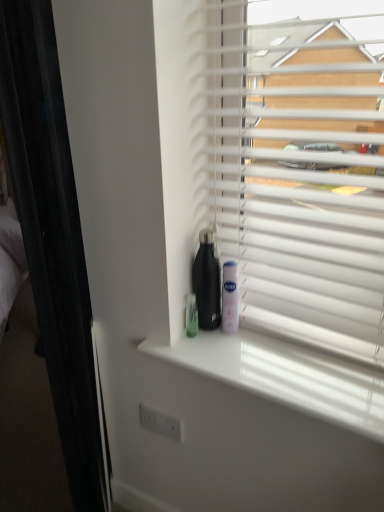
Question: From their relative heights in the image, would you say white plastic blinds at upper right is taller or shorter than white plastic mouthwash at center?

Choices:
 (A) short
 (B) tall

Answer: (B)

Question: From the image's perspective, relative to white plastic mouthwash at center, is white plastic blinds at upper right above or below?

Choices:
 (A) above
 (B) below

Answer: (A)

Question: Which object is the farthest from the white plastic blinds at upper right?

Choices:
 (A) black matte water bottle at center
 (B) white plastic mouthwash at center
 (C) white glossy window sill at center

Answer: (B)

Question: Which is farther from the white plastic blinds at upper right?

Choices:
 (A) white plastic mouthwash at center
 (B) white glossy window sill at center
 (C) black matte water bottle at center

Answer: (A)